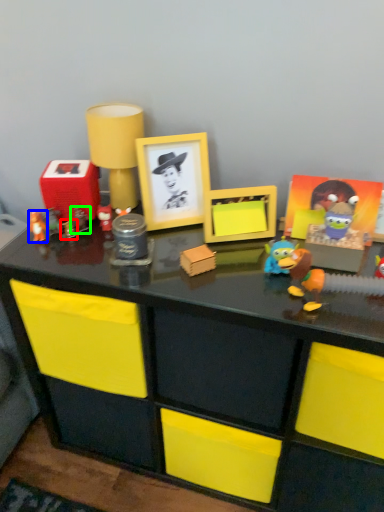
Question: Based on their relative distances, which object is nearer to toy (highlighted by a red box)? Choose from toy (highlighted by a blue box) and toy (highlighted by a green box).

Choices:
 (A) toy
 (B) toy

Answer: (B)